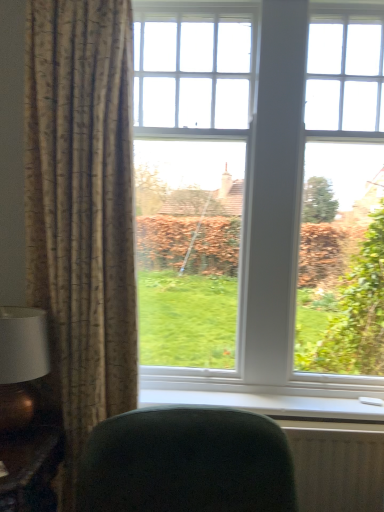
Question: From a real-world perspective, is dark green fabric chair at lower center located higher than textured beige curtain at left?

Choices:
 (A) no
 (B) yes

Answer: (A)

Question: Is dark green fabric chair at lower center closer to the viewer compared to textured beige curtain at left?

Choices:
 (A) no
 (B) yes

Answer: (B)

Question: Could you tell me if dark green fabric chair at lower center is turned towards textured beige curtain at left?

Choices:
 (A) no
 (B) yes

Answer: (A)

Question: Considering the relative sizes of dark green fabric chair at lower center and textured beige curtain at left in the image provided, is dark green fabric chair at lower center thinner than textured beige curtain at left?

Choices:
 (A) yes
 (B) no

Answer: (B)

Question: Does dark green fabric chair at lower center have a larger size compared to textured beige curtain at left?

Choices:
 (A) no
 (B) yes

Answer: (A)

Question: Is dark green fabric chair at lower center positioned behind textured beige curtain at left?

Choices:
 (A) no
 (B) yes

Answer: (A)

Question: Is white textured radiator at lower right not near wooden table at lower left?

Choices:
 (A) yes
 (B) no

Answer: (A)

Question: From a real-world perspective, does white textured radiator at lower right sit lower than wooden table at lower left?

Choices:
 (A) no
 (B) yes

Answer: (A)

Question: Is white textured radiator at lower right taller than wooden table at lower left?

Choices:
 (A) yes
 (B) no

Answer: (B)

Question: Can you confirm if white textured radiator at lower right is positioned to the left of wooden table at lower left?

Choices:
 (A) no
 (B) yes

Answer: (A)

Question: Is white textured radiator at lower right positioned in front of wooden table at lower left?

Choices:
 (A) no
 (B) yes

Answer: (A)

Question: Could you tell me if white textured radiator at lower right is turned towards wooden table at lower left?

Choices:
 (A) yes
 (B) no

Answer: (B)

Question: Does white plastic window sill at lower center have a lesser height compared to wooden table at lower left?

Choices:
 (A) no
 (B) yes

Answer: (B)